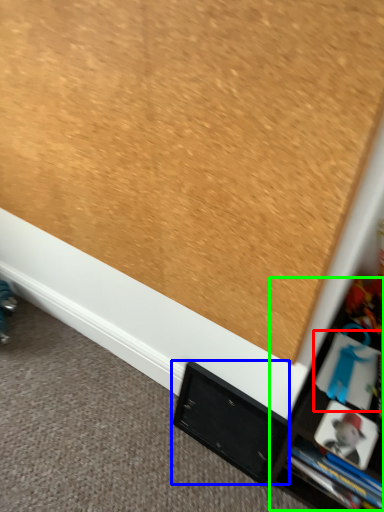
Question: Estimate the real-world distances between objects in this image. Which object is closer to book (highlighted by a red box), cabinet (highlighted by a blue box) or tv cabinet (highlighted by a green box)?

Choices:
 (A) cabinet
 (B) tv cabinet

Answer: (B)